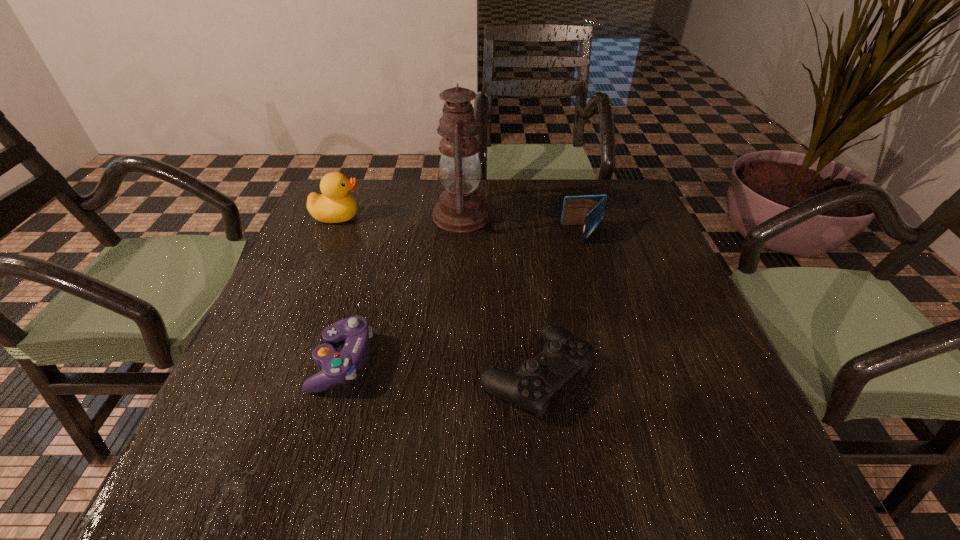
Identify the location of free region that satisfies the following two spatial constraints: 1. on the back side of the right control; 2. at the beak of the leftmost object. This screenshot has height=540, width=960. (517, 216).

This screenshot has height=540, width=960. Identify the location of free location that satisfies the following two spatial constraints: 1. at the beak of the left control; 2. on the left side of the leftmost object. (276, 361).

The image size is (960, 540). I want to click on free space that satisfies the following two spatial constraints: 1. at the beak of the left control; 2. on the right side of the leftmost object, so click(276, 361).